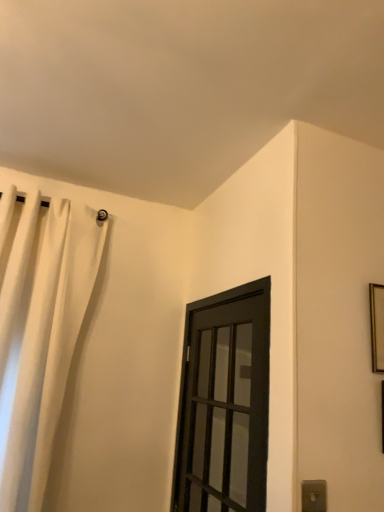
In order to face white fabric curtain at upper left, should I rotate leftwards or rightwards?

Rotate left and turn 19.065 degrees.

Image resolution: width=384 pixels, height=512 pixels. I want to click on black matte door at center, so click(224, 403).

Where is `gray plastic electric outlet at lower right`? Image resolution: width=384 pixels, height=512 pixels. gray plastic electric outlet at lower right is located at coordinates (314, 495).

The height and width of the screenshot is (512, 384). I want to click on gold metallic picture frame at upper right, so click(x=377, y=326).

From the image's perspective, is white fabric curtain at upper left located beneath gold metallic picture frame at upper right?

Correct, white fabric curtain at upper left appears lower than gold metallic picture frame at upper right in the image.

Looking at this image, which of these two, white fabric curtain at upper left or gold metallic picture frame at upper right, is thinner?

Thinner between the two is gold metallic picture frame at upper right.

Is white fabric curtain at upper left directly adjacent to gold metallic picture frame at upper right?

white fabric curtain at upper left and gold metallic picture frame at upper right are not in contact.

Is point (225, 483) positioned in front of point (378, 327)?

No, it is not.

From a real-world perspective, is black matte door at center on gold metallic picture frame at upper right?

Incorrect, from a real-world perspective, black matte door at center is lower than gold metallic picture frame at upper right.

Consider the image. Between black matte door at center and gold metallic picture frame at upper right, which one has larger size?

black matte door at center.

Is white fabric curtain at upper left at the back of gold metallic picture frame at upper right?

No.

Who is more distant, gold metallic picture frame at upper right or white fabric curtain at upper left?

white fabric curtain at upper left is further away from the camera.

Between gold metallic picture frame at upper right and white fabric curtain at upper left, which one appears on the right side from the viewer's perspective?

gold metallic picture frame at upper right is more to the right.

Is point (206, 403) farther from viewer compared to point (322, 493)?

Yes, it is behind point (322, 493).

From the image's perspective, is black matte door at center below gray plastic electric outlet at lower right?

No.

From their relative heights in the image, would you say black matte door at center is taller or shorter than gray plastic electric outlet at lower right?

black matte door at center is taller than gray plastic electric outlet at lower right.

Is black matte door at center beside gray plastic electric outlet at lower right?

There is a gap between black matte door at center and gray plastic electric outlet at lower right.

Based on the photo, from a real-world perspective, which is physically below, gold metallic picture frame at upper right or gray plastic electric outlet at lower right?

gray plastic electric outlet at lower right, from a real-world perspective.

Would you say gray plastic electric outlet at lower right is part of gold metallic picture frame at upper right's contents?

No.

From the image's perspective, which one is positioned higher, gold metallic picture frame at upper right or gray plastic electric outlet at lower right?

gold metallic picture frame at upper right is shown above in the image.

Between point (374, 288) and point (320, 490), which one is positioned behind?

The point (374, 288) is behind.

Is gray plastic electric outlet at lower right in front of or behind white fabric curtain at upper left in the image?

In the image, gray plastic electric outlet at lower right appears in front of white fabric curtain at upper left.

Can you confirm if gray plastic electric outlet at lower right is smaller than white fabric curtain at upper left?

Yes, gray plastic electric outlet at lower right is smaller than white fabric curtain at upper left.

From the picture: Between gray plastic electric outlet at lower right and white fabric curtain at upper left, which one has larger width?

With larger width is white fabric curtain at upper left.

Does gray plastic electric outlet at lower right appear on the right side of white fabric curtain at upper left?

Indeed, gray plastic electric outlet at lower right is positioned on the right side of white fabric curtain at upper left.

From the image's perspective, is gold metallic picture frame at upper right positioned above or below black matte door at center?

Clearly, from the image's perspective, gold metallic picture frame at upper right is above black matte door at center.

Considering the relative positions of gold metallic picture frame at upper right and black matte door at center in the image provided, is gold metallic picture frame at upper right to the right of black matte door at center from the viewer's perspective?

Yes.

From a real-world perspective, is gold metallic picture frame at upper right physically above black matte door at center?

Yes.

Considering the sizes of objects gold metallic picture frame at upper right and black matte door at center in the image provided, who is thinner, gold metallic picture frame at upper right or black matte door at center?

gold metallic picture frame at upper right.

Where is `picture frame above the white fabric curtain at upper left (from a real-world perspective)`? This screenshot has height=512, width=384. picture frame above the white fabric curtain at upper left (from a real-world perspective) is located at coordinates [x=377, y=326].

The height and width of the screenshot is (512, 384). Find the location of `picture frame above the black matte door at center (from the image's perspective)`. picture frame above the black matte door at center (from the image's perspective) is located at coordinates (377, 326).

Considering their positions, is gray plastic electric outlet at lower right positioned closer to gold metallic picture frame at upper right than white fabric curtain at upper left?

gray plastic electric outlet at lower right.

Based on the photo, when comparing their distances from gray plastic electric outlet at lower right, does gold metallic picture frame at upper right or white fabric curtain at upper left seem closer?

Based on the image, gold metallic picture frame at upper right appears to be nearer to gray plastic electric outlet at lower right.

From the image, which object appears to be nearer to gold metallic picture frame at upper right, black matte door at center or white fabric curtain at upper left?

black matte door at center.

Which object lies further to the anchor point gray plastic electric outlet at lower right, black matte door at center or white fabric curtain at upper left?

white fabric curtain at upper left lies further to gray plastic electric outlet at lower right than the other object.

Looking at the image, which one is located further to white fabric curtain at upper left, black matte door at center or gray plastic electric outlet at lower right?

gray plastic electric outlet at lower right is positioned further to the anchor white fabric curtain at upper left.

Based on the photo, considering their positions, is gray plastic electric outlet at lower right positioned further to black matte door at center than gold metallic picture frame at upper right?

Based on the image, gold metallic picture frame at upper right appears to be further to black matte door at center.

Looking at the image, which one is located further to gold metallic picture frame at upper right, white fabric curtain at upper left or black matte door at center?

white fabric curtain at upper left is positioned further to the anchor gold metallic picture frame at upper right.

Considering their positions, is white fabric curtain at upper left positioned closer to gold metallic picture frame at upper right than gray plastic electric outlet at lower right?

gray plastic electric outlet at lower right.

At what (x,y) coordinates should I click in order to perform the action: click on electric outlet between white fabric curtain at upper left and gold metallic picture frame at upper right. Please return your answer as a coordinate pair (x, y). This screenshot has width=384, height=512. Looking at the image, I should click on (314, 495).

Locate an element on the screen. electric outlet situated between black matte door at center and gold metallic picture frame at upper right from left to right is located at coordinates (314, 495).

The height and width of the screenshot is (512, 384). What are the coordinates of `door located between white fabric curtain at upper left and gold metallic picture frame at upper right in the left-right direction` in the screenshot? It's located at (224, 403).

The width and height of the screenshot is (384, 512). What are the coordinates of `door between white fabric curtain at upper left and gray plastic electric outlet at lower right from left to right` in the screenshot? It's located at (224, 403).